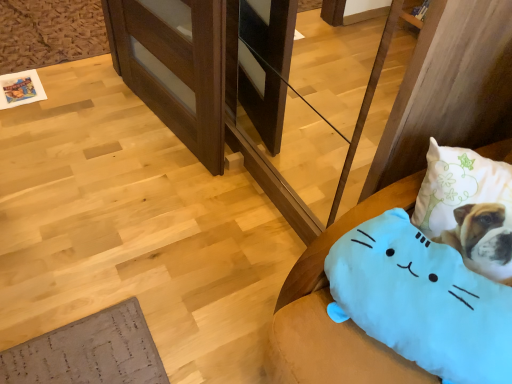
Question: Does blue plush cat at lower right appear on the right side of blue plush cat at lower right?

Choices:
 (A) yes
 (B) no

Answer: (B)

Question: Considering the relative positions of blue plush cat at lower right and blue plush cat at lower right in the image provided, is blue plush cat at lower right behind blue plush cat at lower right?

Choices:
 (A) no
 (B) yes

Answer: (B)

Question: Can you confirm if blue plush cat at lower right is bigger than blue plush cat at lower right?

Choices:
 (A) no
 (B) yes

Answer: (B)

Question: Are blue plush cat at lower right and blue plush cat at lower right making contact?

Choices:
 (A) no
 (B) yes

Answer: (A)

Question: Considering the relative sizes of blue plush cat at lower right and blue plush cat at lower right in the image provided, is blue plush cat at lower right smaller than blue plush cat at lower right?

Choices:
 (A) no
 (B) yes

Answer: (A)

Question: Does blue plush cat at lower right have a greater height compared to blue plush cat at lower right?

Choices:
 (A) yes
 (B) no

Answer: (A)

Question: Is wooden at left behind blue plush cat at lower right?

Choices:
 (A) no
 (B) yes

Answer: (B)

Question: Can you confirm if wooden at left is positioned to the right of blue plush cat at lower right?

Choices:
 (A) no
 (B) yes

Answer: (A)

Question: Is wooden at left thinner than blue plush cat at lower right?

Choices:
 (A) yes
 (B) no

Answer: (A)

Question: Are wooden at left and blue plush cat at lower right located far from each other?

Choices:
 (A) no
 (B) yes

Answer: (A)

Question: From the image's perspective, is wooden at left above blue plush cat at lower right?

Choices:
 (A) yes
 (B) no

Answer: (A)

Question: Is wooden at left touching blue plush cat at lower right?

Choices:
 (A) yes
 (B) no

Answer: (B)

Question: Is blue plush cat at lower right in front of wooden at left?

Choices:
 (A) yes
 (B) no

Answer: (A)